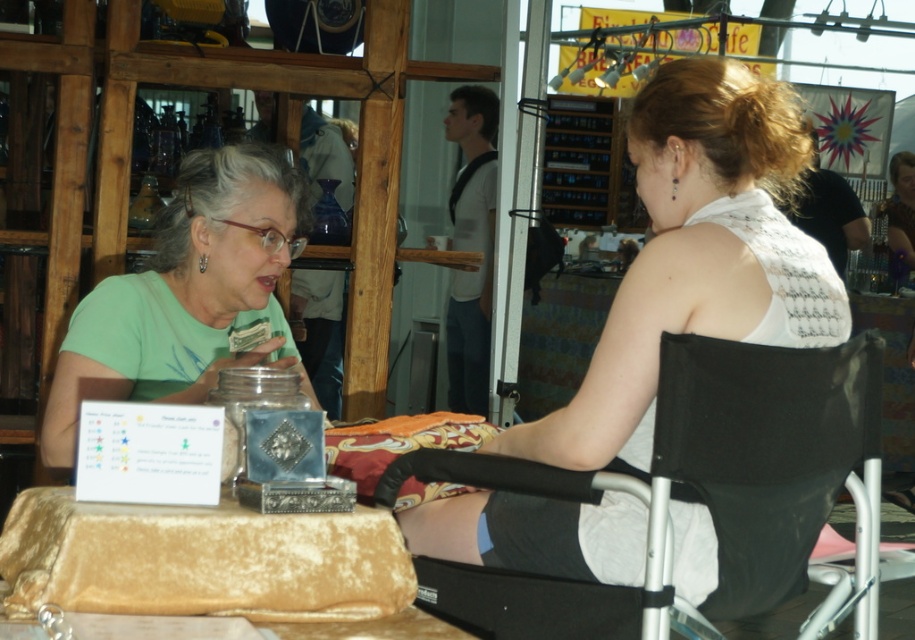
Can you confirm if black fabric folding chair at right is bigger than green matte shirt at left?

No, black fabric folding chair at right is not bigger than green matte shirt at left.

Can you confirm if black fabric folding chair at right is positioned above green matte shirt at left?

Incorrect, black fabric folding chair at right is not positioned above green matte shirt at left.

Between point (551, 577) and point (67, 387), which one is positioned behind?

Positioned behind is point (67, 387).

Image resolution: width=915 pixels, height=640 pixels. Find the location of `black fabric folding chair at right`. black fabric folding chair at right is located at coordinates (763, 451).

Consider the image. Can you confirm if white lace tank top at center is positioned to the left of black fabric folding chair at right?

Indeed, white lace tank top at center is positioned on the left side of black fabric folding chair at right.

Between point (767, 145) and point (666, 333), which one is positioned behind?

Point (767, 145)

Find the location of a particular element. white lace tank top at center is located at coordinates (696, 257).

Is point (767, 266) positioned after point (187, 403)?

That is False.

Looking at this image, between white lace tank top at center and green matte shirt at left, which one appears on the right side from the viewer's perspective?

Positioned to the right is white lace tank top at center.

At what (x,y) coordinates should I click in order to perform the action: click on white lace tank top at center. Please return your answer as a coordinate pair (x, y). Looking at the image, I should click on (696, 257).